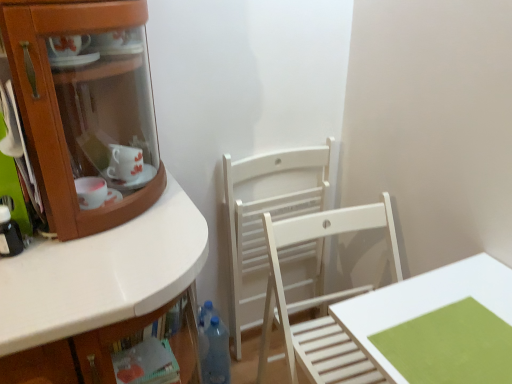
Based on the photo, what is the approximate width of white wood chair at center, the second chair from the front?

9.84 centimeters.

The image size is (512, 384). Describe the element at coordinates (261, 218) in the screenshot. I see `white wood chair at center, the second chair from the front` at that location.

What do you see at coordinates (323, 297) in the screenshot? I see `white wooden chair at center, the 1th chair in the front-to-back sequence` at bounding box center [323, 297].

Identify the location of transparent plastic bottle at lower center, which ranks as the 2th bottle in front-to-back order. The image size is (512, 384). (217, 354).

The image size is (512, 384). What do you see at coordinates (217, 354) in the screenshot?
I see `transparent plastic bottle at lower center, which is counted as the first bottle, starting from the bottom` at bounding box center [217, 354].

In order to click on white matte table at lower right in this screenshot , I will do `click(424, 301)`.

Is white wooden chair at center, the 2th chair from the back, not close to white matte table at lower right?

They are positioned close to each other.

How different are the orientations of white wooden chair at center, the 2th chair from the back, and white matte table at lower right in degrees?

The facing directions of white wooden chair at center, the 2th chair from the back, and white matte table at lower right are 90.2 degrees apart.

Which is in front, white wooden chair at center, the 2th chair from the back, or white matte table at lower right?

white matte table at lower right is more forward.

Based on their sizes in the image, would you say white wooden chair at center, the 1th chair in the front-to-back sequence, is bigger or smaller than white matte table at lower right?

Considering their sizes, white wooden chair at center, the 1th chair in the front-to-back sequence, takes up more space than white matte table at lower right.

From the image's perspective, which is above, white wood chair at center, the second chair from the front, or white wooden chair at center, the 2th chair from the back?

white wood chair at center, the second chair from the front, appears higher in the image.

Between white wood chair at center, the second chair from the front, and white wooden chair at center, the 2th chair from the back, which one has larger size?

white wooden chair at center, the 2th chair from the back.

Can you see white wood chair at center, the first chair from the back, touching white wooden chair at center, the 2th chair from the back?

No, white wood chair at center, the first chair from the back, is not in contact with white wooden chair at center, the 2th chair from the back.

Is transparent plastic bottle at lower center, which ranks as the 2th bottle in front-to-back order, inside the boundaries of translucent plastic bottle at left, which ranks as the 1th bottle in top-to-bottom order, or outside?

transparent plastic bottle at lower center, which ranks as the 2th bottle in front-to-back order, exists outside the volume of translucent plastic bottle at left, which ranks as the 1th bottle in top-to-bottom order.

Is point (211, 381) closer or farther from the camera than point (5, 215)?

Point (211, 381) is positioned farther from the camera compared to point (5, 215).

How different are the orientations of transparent plastic bottle at lower center, which appears as the 1th bottle when viewed from the right, and translucent plastic bottle at left, the second bottle viewed from the back, in degrees?

There is a 0.461-degree angle between the facing directions of transparent plastic bottle at lower center, which appears as the 1th bottle when viewed from the right, and translucent plastic bottle at left, the second bottle viewed from the back.

Is transparent plastic bottle at lower center, which appears as the 1th bottle when viewed from the right, looking in the opposite direction of translucent plastic bottle at left, the 2th bottle in the bottom-to-top sequence?

No, transparent plastic bottle at lower center, which appears as the 1th bottle when viewed from the right, is not facing the opposite direction of translucent plastic bottle at left, the 2th bottle in the bottom-to-top sequence.

Is translucent plastic bottle at left, the 2th bottle in the bottom-to-top sequence, far away from white matte table at lower right?

No, translucent plastic bottle at left, the 2th bottle in the bottom-to-top sequence, is not far from white matte table at lower right.

From their relative heights in the image, would you say translucent plastic bottle at left, which ranks as the 1th bottle in top-to-bottom order, is taller or shorter than white matte table at lower right?

Considering their sizes, translucent plastic bottle at left, which ranks as the 1th bottle in top-to-bottom order, has less height than white matte table at lower right.

From the image's perspective, relative to white matte table at lower right, is translucent plastic bottle at left, the 2th bottle in the right-to-left sequence, above or below?

translucent plastic bottle at left, the 2th bottle in the right-to-left sequence, is above white matte table at lower right.

Is point (5, 230) positioned before point (402, 318)?

No, it is behind (402, 318).

How much distance is there between translucent plastic bottle at left, the second bottle viewed from the back, and white wooden chair at center, the 2th chair from the back?

translucent plastic bottle at left, the second bottle viewed from the back, and white wooden chair at center, the 2th chair from the back, are 33.64 inches apart.

Can you confirm if translucent plastic bottle at left, the second bottle viewed from the back, is thinner than white wooden chair at center, the 2th chair from the back?

Correct, the width of translucent plastic bottle at left, the second bottle viewed from the back, is less than that of white wooden chair at center, the 2th chair from the back.

Who is taller, translucent plastic bottle at left, the second bottle viewed from the back, or white wooden chair at center, the 1th chair in the front-to-back sequence?

white wooden chair at center, the 1th chair in the front-to-back sequence.

Is transparent plastic bottle at lower center, which is counted as the second bottle, starting from the left, with white matte table at lower right?

transparent plastic bottle at lower center, which is counted as the second bottle, starting from the left, and white matte table at lower right are clearly separated.

Between transparent plastic bottle at lower center, which is counted as the second bottle, starting from the left, and white matte table at lower right, which one appears on the right side from the viewer's perspective?

Positioned to the right is white matte table at lower right.

Locate an element on the screen. The image size is (512, 384). bottle that is the 2nd one when counting backward from the white matte table at lower right is located at coordinates (217, 354).

Between transparent plastic bottle at lower center, the 2th bottle when ordered from top to bottom, and white matte table at lower right, which one has less height?

Standing shorter between the two is white matte table at lower right.

From the image's perspective, is white matte table at lower right located above or below white wood chair at center, the second chair from the front?

Based on their image positions, white matte table at lower right is located beneath white wood chair at center, the second chair from the front.

Which of these two, white matte table at lower right or white wood chair at center, the second chair from the front, is bigger?

With larger size is white matte table at lower right.

Consider the image. In the image, is white matte table at lower right positioned in front of or behind white wood chair at center, the second chair from the front?

white matte table at lower right is in front of white wood chair at center, the second chair from the front.

From the picture: Which object is positioned more to the left, white matte table at lower right or white wood chair at center, the second chair from the front?

From the viewer's perspective, white wood chair at center, the second chair from the front, appears more on the left side.

I want to click on chair lying below the white matte table at lower right (from the image's perspective), so click(323, 297).

Where is `chair in front of the white wood chair at center, the second chair from the front`? The height and width of the screenshot is (384, 512). chair in front of the white wood chair at center, the second chair from the front is located at coordinates (323, 297).

Consider the image. When comparing their distances from white wooden chair at center, the 2th chair from the back, does transparent plastic bottle at lower center, which is counted as the first bottle, starting from the bottom, or white matte table at lower right seem closer?

white matte table at lower right.

From the image, which object appears to be nearer to transparent plastic bottle at lower center, the 2th bottle when ordered from top to bottom, white matte table at lower right or white wooden chair at center, the 1th chair in the front-to-back sequence?

The object closer to transparent plastic bottle at lower center, the 2th bottle when ordered from top to bottom, is white wooden chair at center, the 1th chair in the front-to-back sequence.

Estimate the real-world distances between objects in this image. Which object is closer to translucent plastic bottle at left, which ranks as the first bottle in front-to-back order, transparent plastic bottle at lower center, which is counted as the second bottle, starting from the left, or white wood chair at center, the second chair from the front?

transparent plastic bottle at lower center, which is counted as the second bottle, starting from the left, lies closer to translucent plastic bottle at left, which ranks as the first bottle in front-to-back order, than the other object.

Estimate the real-world distances between objects in this image. Which object is closer to translucent plastic bottle at left, the 2th bottle in the right-to-left sequence, white wooden chair at center, the 1th chair in the front-to-back sequence, or white wood chair at center, the second chair from the front?

white wooden chair at center, the 1th chair in the front-to-back sequence, is positioned closer to the anchor translucent plastic bottle at left, the 2th bottle in the right-to-left sequence.

When comparing their distances from white wood chair at center, the second chair from the front, does translucent plastic bottle at left, the 2th bottle in the right-to-left sequence, or transparent plastic bottle at lower center, which ranks as the 2th bottle in front-to-back order, seem further?

Among the two, translucent plastic bottle at left, the 2th bottle in the right-to-left sequence, is located further to white wood chair at center, the second chair from the front.

When comparing their distances from white wooden chair at center, the 2th chair from the back, does translucent plastic bottle at left, the 2th bottle in the right-to-left sequence, or white wood chair at center, the second chair from the front, seem closer?

white wood chair at center, the second chair from the front, lies closer to white wooden chair at center, the 2th chair from the back, than the other object.

Estimate the real-world distances between objects in this image. Which object is closer to translucent plastic bottle at left, the 1th bottle when ordered from left to right, white wood chair at center, the first chair from the back, or transparent plastic bottle at lower center, the 2th bottle when ordered from top to bottom?

Among the two, transparent plastic bottle at lower center, the 2th bottle when ordered from top to bottom, is located nearer to translucent plastic bottle at left, the 1th bottle when ordered from left to right.

From the image, which object appears to be farther from white matte table at lower right, white wood chair at center, the first chair from the back, or transparent plastic bottle at lower center, positioned as the first bottle in back-to-front order?

Based on the image, transparent plastic bottle at lower center, positioned as the first bottle in back-to-front order, appears to be further to white matte table at lower right.

At what (x,y) coordinates should I click in order to perform the action: click on bottle between translucent plastic bottle at left, which ranks as the 1th bottle in top-to-bottom order, and white matte table at lower right from left to right. Please return your answer as a coordinate pair (x, y). Looking at the image, I should click on (217, 354).

Identify the location of chair between white wooden chair at center, the 2th chair from the back, and transparent plastic bottle at lower center, the 2th bottle when ordered from top to bottom, in the front-back direction. (261, 218).

Image resolution: width=512 pixels, height=384 pixels. I want to click on bottle located between translucent plastic bottle at left, the second bottle viewed from the back, and white wood chair at center, the second chair from the front, in the left-right direction, so click(217, 354).

Locate an element on the screen. Image resolution: width=512 pixels, height=384 pixels. bottle between translucent plastic bottle at left, which ranks as the 1th bottle in top-to-bottom order, and white wooden chair at center, the 1th chair in the front-to-back sequence, from left to right is located at coordinates (217, 354).